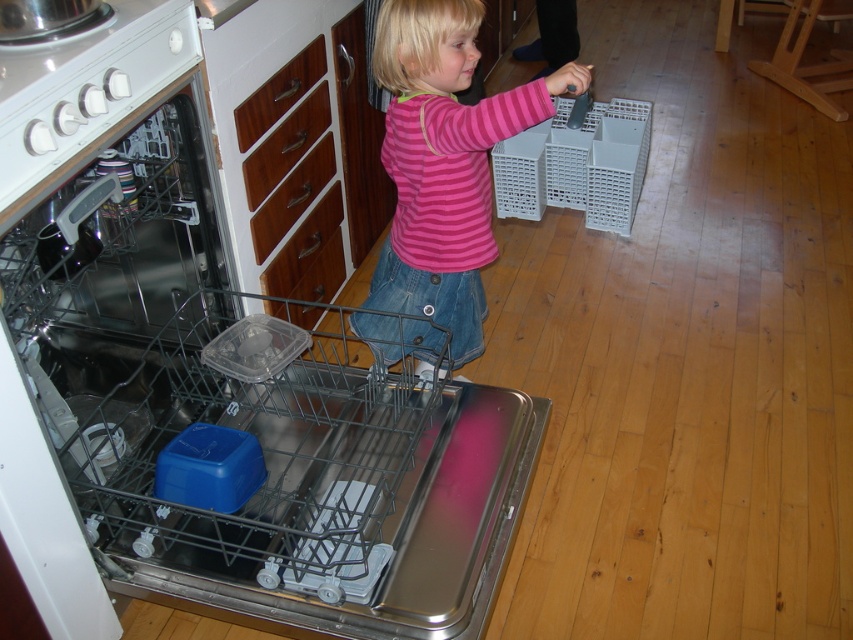
Question: Is metallic dishwasher at center thinner than pink striped shirt at center?

Choices:
 (A) no
 (B) yes

Answer: (A)

Question: Which of the following is the closest to the observer?

Choices:
 (A) (453, 314)
 (B) (71, 512)

Answer: (B)

Question: Does metallic dishwasher at center appear on the left side of pink striped shirt at center?

Choices:
 (A) no
 (B) yes

Answer: (B)

Question: Does metallic dishwasher at center appear on the left side of pink striped shirt at center?

Choices:
 (A) yes
 (B) no

Answer: (A)

Question: Which object appears closest to the camera in this image?

Choices:
 (A) pink striped shirt at center
 (B) metallic dishwasher at center

Answer: (B)